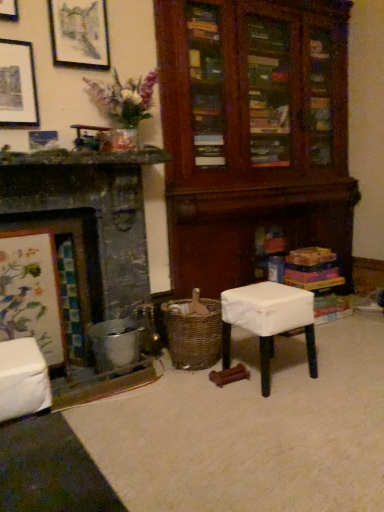
I want to click on vacant area that lies in front of woven brown basket at lower center, so click(x=185, y=392).